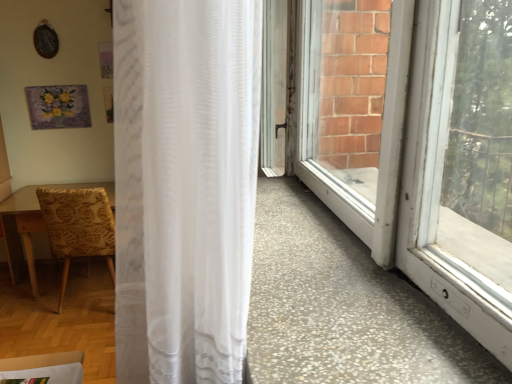
At what (x,y) coordinates should I click in order to perform the action: click on patterned fabric chair at left. Please return your answer as a coordinate pair (x, y). The width and height of the screenshot is (512, 384). Looking at the image, I should click on (78, 226).

Image resolution: width=512 pixels, height=384 pixels. Describe the element at coordinates (78, 226) in the screenshot. I see `patterned fabric chair at left` at that location.

Describe the element at coordinates (184, 186) in the screenshot. This screenshot has width=512, height=384. I see `white sheer curtain at center` at that location.

Locate an element on the screen. The image size is (512, 384). white sheer curtain at center is located at coordinates (184, 186).

This screenshot has height=384, width=512. I want to click on patterned fabric chair at left, so click(x=78, y=226).

Which is more to the right, white sheer curtain at center or patterned fabric chair at left?

white sheer curtain at center is more to the right.

In the image, is white sheer curtain at center positioned in front of or behind patterned fabric chair at left?

Visually, white sheer curtain at center is located in front of patterned fabric chair at left.

Which is in front, point (133, 308) or point (51, 228)?

The point (133, 308) is in front.

From the image's perspective, is white sheer curtain at center above patterned fabric chair at left?

Yes, from the image's perspective, white sheer curtain at center is on top of patterned fabric chair at left.

From a real-world perspective, which object stands above the other?

white sheer curtain at center.

Does white sheer curtain at center have a greater width compared to patterned fabric chair at left?

No.

Considering the relative sizes of white sheer curtain at center and patterned fabric chair at left in the image provided, is white sheer curtain at center shorter than patterned fabric chair at left?

No.

From the picture: Considering the relative sizes of white sheer curtain at center and patterned fabric chair at left in the image provided, is white sheer curtain at center smaller than patterned fabric chair at left?

Yes, white sheer curtain at center is smaller than patterned fabric chair at left.

Would you say patterned fabric chair at left is part of white sheer curtain at center's contents?

That's incorrect, patterned fabric chair at left is not inside white sheer curtain at center.

Is there a large distance between white sheer curtain at center and patterned fabric chair at left?

Absolutely, white sheer curtain at center is distant from patterned fabric chair at left.

Is white sheer curtain at center aimed at patterned fabric chair at left?

No.

This screenshot has height=384, width=512. I want to click on chair on the left of white sheer curtain at center, so click(x=78, y=226).

Is patterned fabric chair at left to the left of white sheer curtain at center from the viewer's perspective?

Correct, you'll find patterned fabric chair at left to the left of white sheer curtain at center.

Consider the image. Is patterned fabric chair at left in front of white sheer curtain at center?

No, patterned fabric chair at left is behind white sheer curtain at center.

Does point (60, 246) appear closer or farther from the camera than point (219, 256)?

Point (60, 246).

From the image's perspective, is patterned fabric chair at left above white sheer curtain at center?

No, from the image's perspective, patterned fabric chair at left is not over white sheer curtain at center.

From a real-world perspective, is patterned fabric chair at left located higher than white sheer curtain at center?

No, from a real-world perspective, patterned fabric chair at left is not above white sheer curtain at center.

Is patterned fabric chair at left thinner than white sheer curtain at center?

No.

Is patterned fabric chair at left shorter than white sheer curtain at center?

Correct, patterned fabric chair at left is not as tall as white sheer curtain at center.

Looking at the image, does patterned fabric chair at left seem bigger or smaller compared to white sheer curtain at center?

patterned fabric chair at left is bigger than white sheer curtain at center.

Is white sheer curtain at center completely or partially inside patterned fabric chair at left?

No, white sheer curtain at center is located outside of patterned fabric chair at left.

Is patterned fabric chair at left positioned far away from white sheer curtain at center?

Yes, patterned fabric chair at left is far from white sheer curtain at center.

Is patterned fabric chair at left positioned with its back to white sheer curtain at center?

patterned fabric chair at left does not have its back to white sheer curtain at center.

Where is `curtain in front of the patterned fabric chair at left`? The image size is (512, 384). curtain in front of the patterned fabric chair at left is located at coordinates (184, 186).

You are a GUI agent. You are given a task and a screenshot of the screen. Output one action in this format:
    pyautogui.click(x=<x>, y=<y>)
    Task: Click on the curtain in front of the patterned fabric chair at left
    
    Given the screenshot: What is the action you would take?
    pyautogui.click(x=184, y=186)

Identify the location of chair on the left of white sheer curtain at center. The height and width of the screenshot is (384, 512). (78, 226).